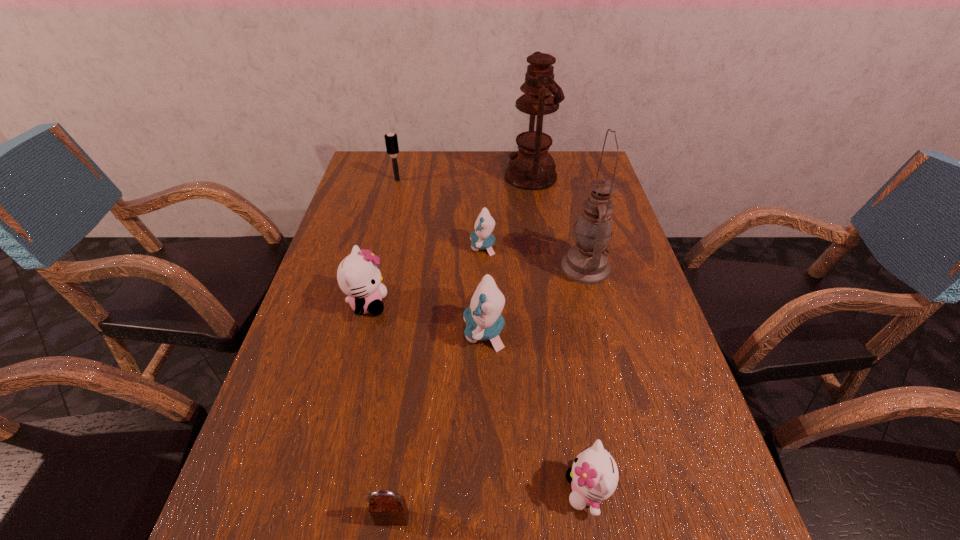
Locate an element on the screen. Image resolution: width=960 pixels, height=540 pixels. the farther oil lamp is located at coordinates (530, 168).

Where is `the nearer oil lamp`? The image size is (960, 540). the nearer oil lamp is located at coordinates (586, 262).

Identify the location of hairbrush. 391,139.

Locate an element on the screen. The width and height of the screenshot is (960, 540). the bigger blue kitten is located at coordinates (483, 318).

This screenshot has height=540, width=960. What are the coordinates of `the left white kitten` in the screenshot? It's located at (358, 275).

At what (x,y) coordinates should I click in order to perform the action: click on the leftmost kitten. Please return your answer as a coordinate pair (x, y). The height and width of the screenshot is (540, 960). Looking at the image, I should click on (358, 275).

Where is `the nearer white kitten`? The width and height of the screenshot is (960, 540). the nearer white kitten is located at coordinates (594, 475).

Image resolution: width=960 pixels, height=540 pixels. Find the location of `the smaller white kitten`. the smaller white kitten is located at coordinates (594, 475).

This screenshot has width=960, height=540. What are the coordinates of `the smaller blue kitten` in the screenshot? It's located at tap(481, 238).

The image size is (960, 540). Find the location of `the farther blue kitten`. the farther blue kitten is located at coordinates (481, 238).